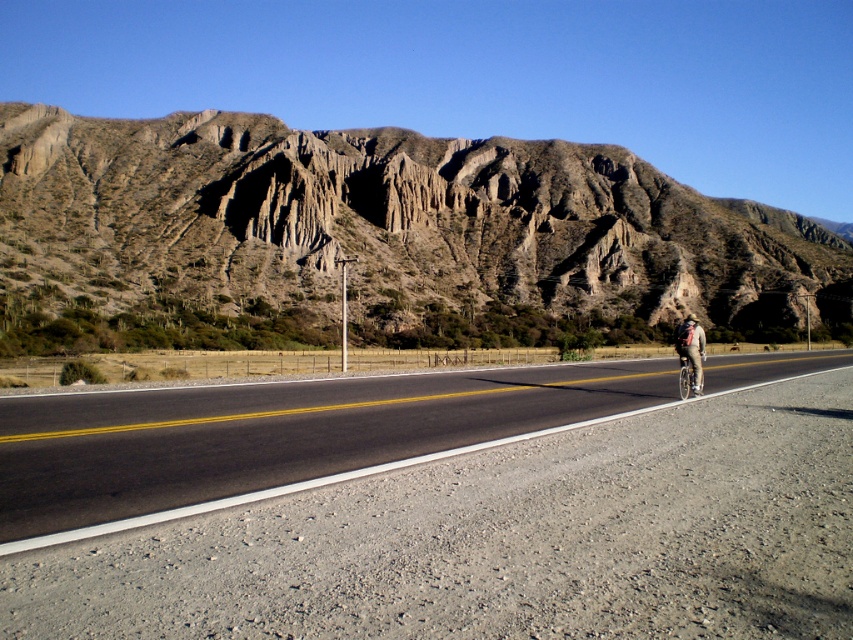
Question: Which of the following is the farthest from the observer?

Choices:
 (A) (132, 467)
 (B) (677, 340)

Answer: (B)

Question: In this image, where is rugged brown rock formation at upper center located relative to black asphalt road at center?

Choices:
 (A) below
 (B) above

Answer: (B)

Question: Is rugged brown rock formation at upper center closer to camera compared to light brown fabric jacket at right?

Choices:
 (A) no
 (B) yes

Answer: (A)

Question: Which of the following is the farthest from the observer?

Choices:
 (A) light brown fabric jacket at right
 (B) black asphalt road at center
 (C) matte black helmet at center
 (D) rugged brown rock formation at upper center

Answer: (D)

Question: Does black asphalt road at center come in front of matte black helmet at center?

Choices:
 (A) yes
 (B) no

Answer: (A)

Question: Estimate the real-world distances between objects in this image. Which object is farther from the matte black helmet at center?

Choices:
 (A) rugged brown rock formation at upper center
 (B) light brown fabric jacket at right
 (C) black asphalt road at center

Answer: (A)